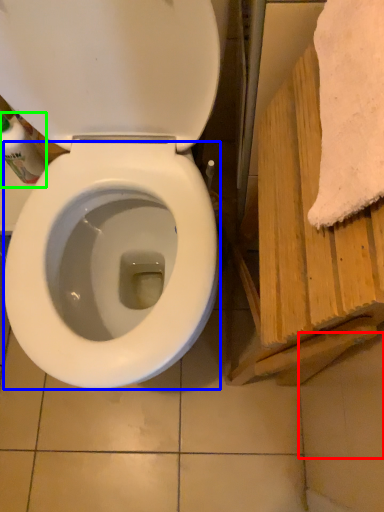
Question: Which object is the farthest from tile (highlighted by a red box)? Choose among these: bidet (highlighted by a blue box) or cleaning product (highlighted by a green box).

Choices:
 (A) bidet
 (B) cleaning product

Answer: (B)